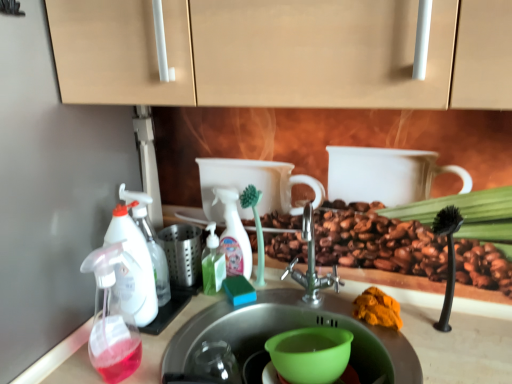
This screenshot has width=512, height=384. I want to click on free point to the left of orange powder at sink, so click(312, 313).